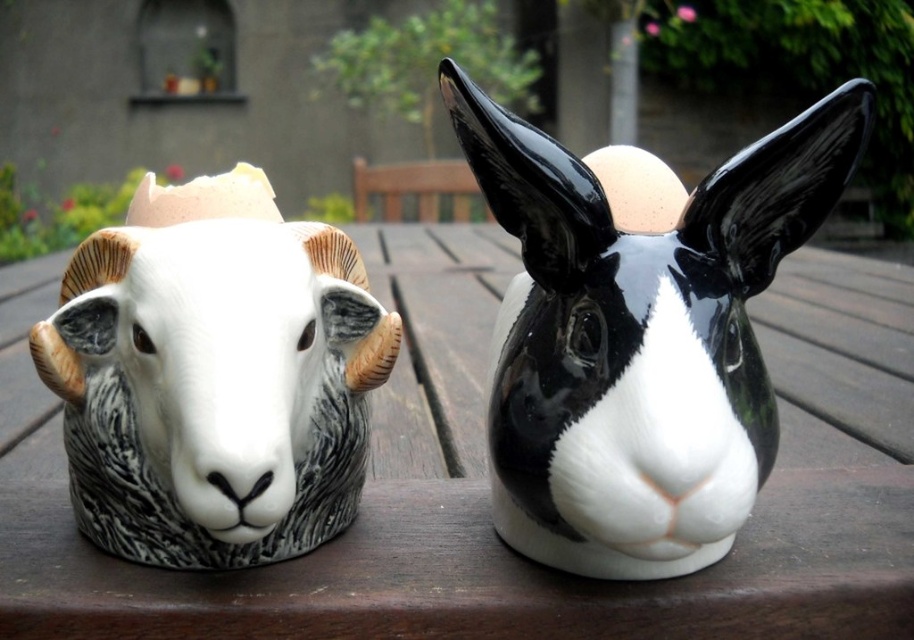
Is wooden picnic table at center below black glossy ram head at center?

No, wooden picnic table at center is not below black glossy ram head at center.

Which is more to the left, wooden picnic table at center or black glossy ram head at center?

black glossy ram head at center

Between point (884, 300) and point (796, 236), which one is positioned in front?

Point (796, 236) is more forward.

At what (x,y) coordinates should I click in order to perform the action: click on wooden picnic table at center. Please return your answer as a coordinate pair (x, y). The height and width of the screenshot is (640, 914). Looking at the image, I should click on (487, 483).

Does wooden picnic table at center appear over white glossy ram head at left?

Correct, wooden picnic table at center is located above white glossy ram head at left.

Can you confirm if wooden picnic table at center is smaller than white glossy ram head at left?

No.

In order to click on wooden picnic table at center in this screenshot , I will do `click(487, 483)`.

Which of these two, black glossy ram head at center or white glossy ram head at left, stands shorter?

white glossy ram head at left

From the picture: Which is more to the left, black glossy ram head at center or white glossy ram head at left?

white glossy ram head at left is more to the left.

Who is more forward, [558,154] or [173,483]?

Point [173,483] is in front.

Locate an element on the screen. This screenshot has width=914, height=640. black glossy ram head at center is located at coordinates (639, 332).